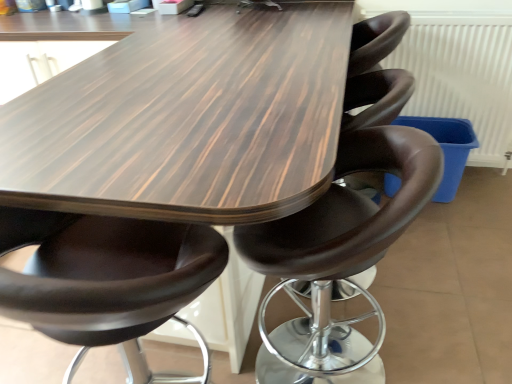
What are the coordinates of `free space above white textured radiator at upper right (from a real-world perspective)` in the screenshot? It's located at (449, 5).